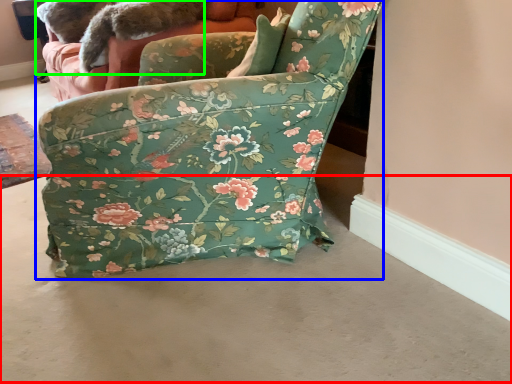
Question: Considering the real-world distances, which object is farthest from concrete (highlighted by a red box)? chair (highlighted by a blue box) or animal (highlighted by a green box)?

Choices:
 (A) chair
 (B) animal

Answer: (B)